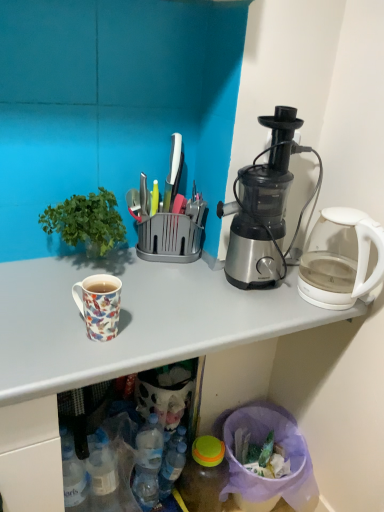
This screenshot has height=512, width=384. I want to click on vacant space underneath satin silver blender at right (from a real-world perspective), so click(243, 288).